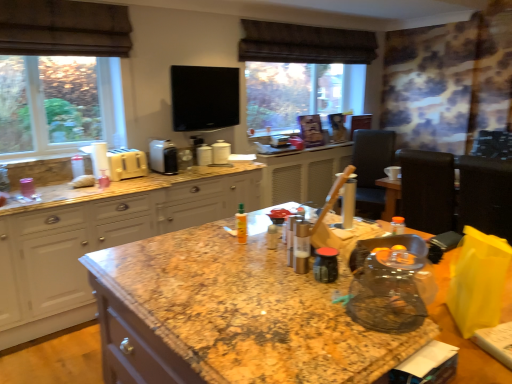
Identify the location of free point to the right of yellow plastic toaster at left, which is the 4th appliance in right-to-left order. (158, 177).